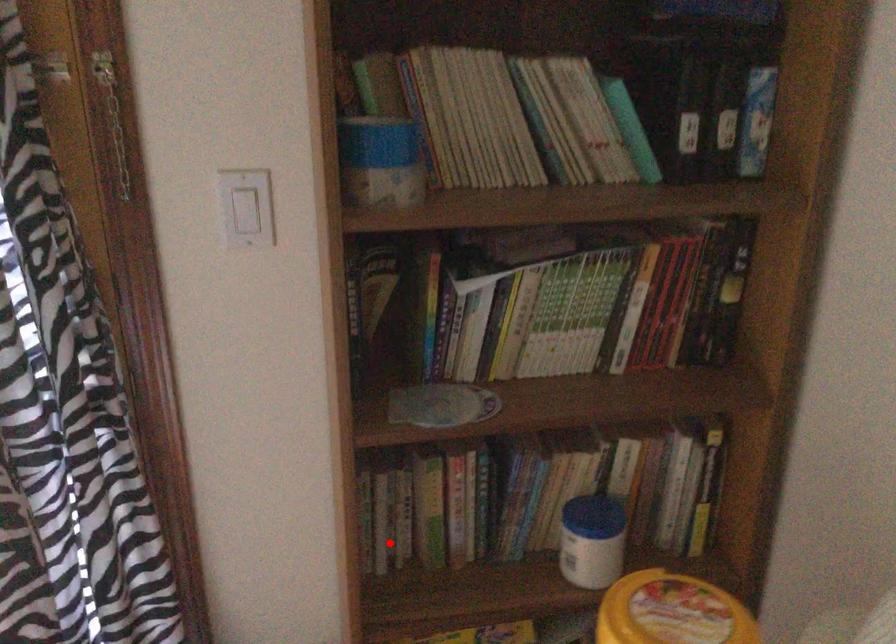
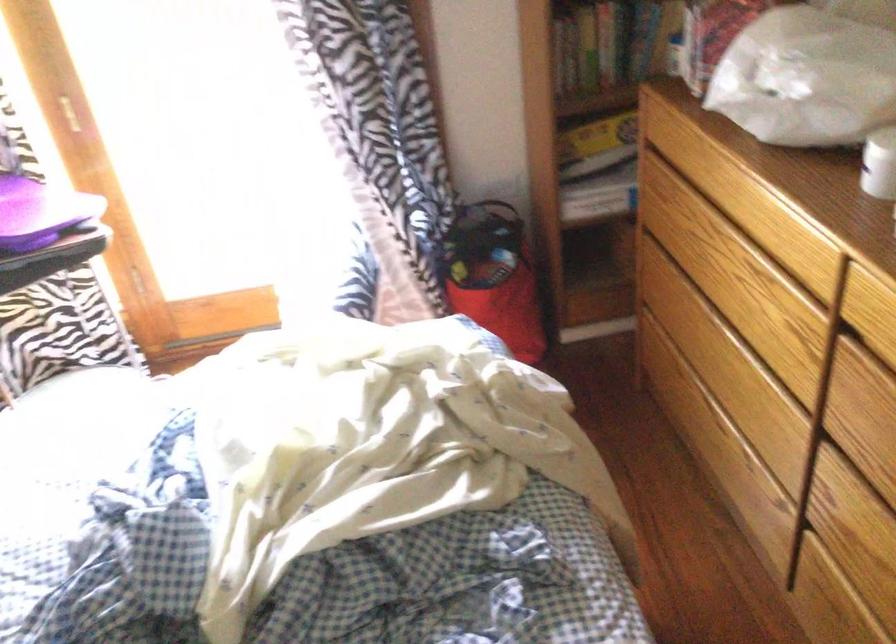
Locate, in the second image, the point that corresponds to the highlighted location in the first image.

(564, 58)